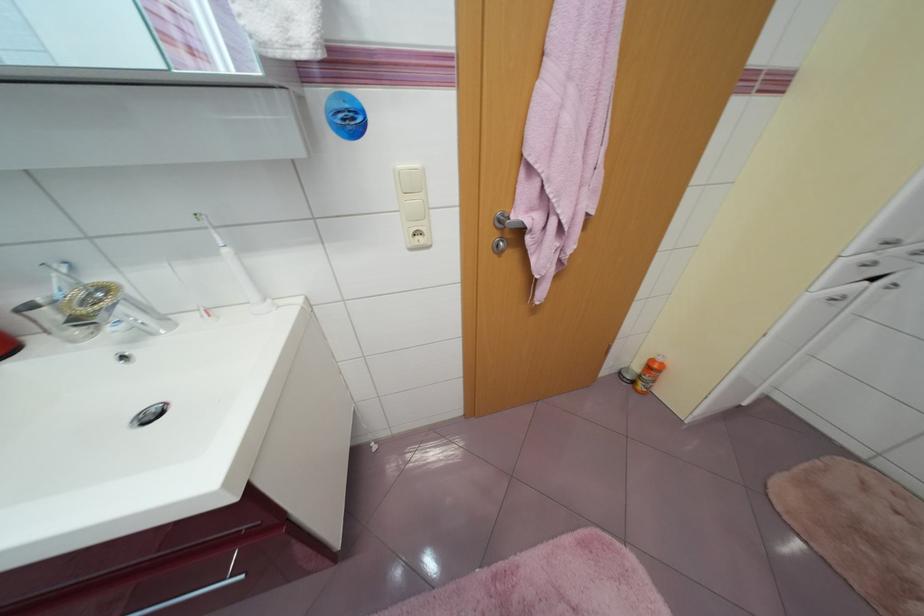
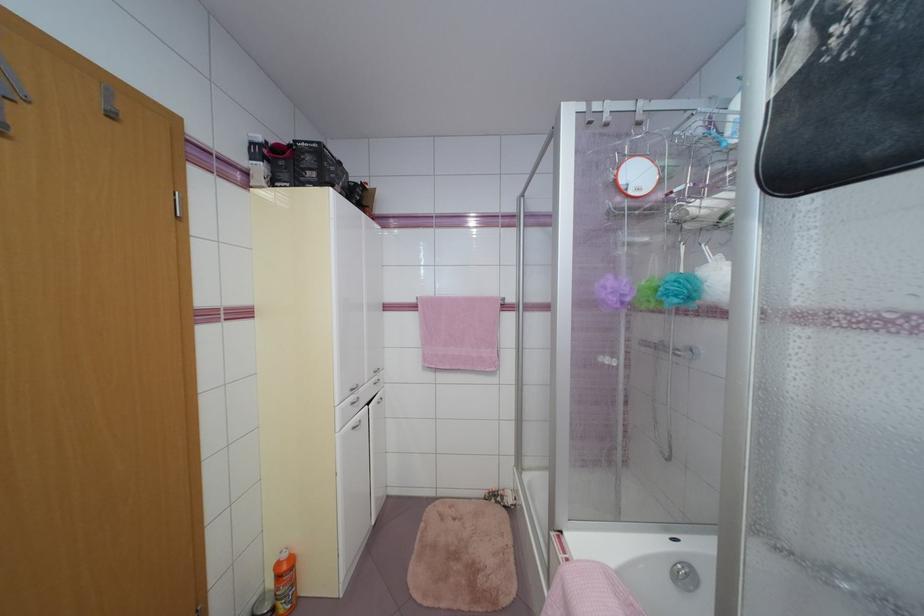
Find the pixel in the second image that matches point 871,259 in the first image.

(357, 400)